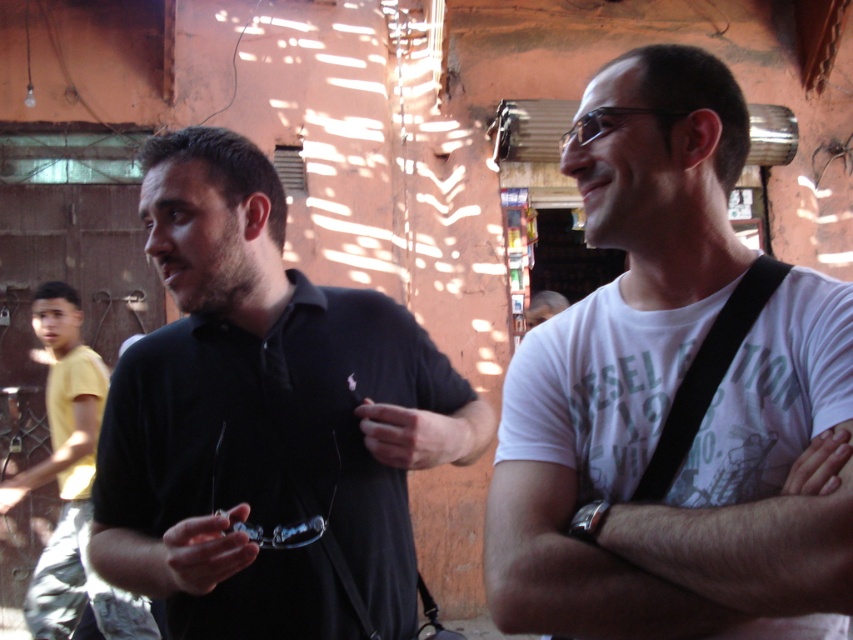
Looking at this image, between black matte shirt at left and white matte t-shirt at center, which one is positioned lower?

black matte shirt at left

Who is more forward, (437, 376) or (695, 324)?

Point (695, 324) is more forward.

Is point (375, 602) farther from camera compared to point (785, 461)?

Yes, it is behind point (785, 461).

Locate an element on the screen. Image resolution: width=853 pixels, height=640 pixels. black matte shirt at left is located at coordinates (265, 419).

Between black matte shirt at left and yellow cotton shirt at left, which one has more height?

With more height is yellow cotton shirt at left.

Does black matte shirt at left have a greater height compared to yellow cotton shirt at left?

Incorrect, black matte shirt at left's height is not larger of yellow cotton shirt at left's.

This screenshot has width=853, height=640. What do you see at coordinates (265, 419) in the screenshot? I see `black matte shirt at left` at bounding box center [265, 419].

This screenshot has width=853, height=640. What are the coordinates of `black matte shirt at left` in the screenshot? It's located at (265, 419).

Can you confirm if white matte t-shirt at center is positioned below yellow cotton shirt at left?

Actually, white matte t-shirt at center is above yellow cotton shirt at left.

Does point (637, 132) lie in front of point (80, 355)?

Yes, it is.

Is point (563, 477) more distant than point (68, 632)?

That is False.

This screenshot has height=640, width=853. What are the coordinates of `white matte t-shirt at center` in the screenshot? It's located at click(622, 355).